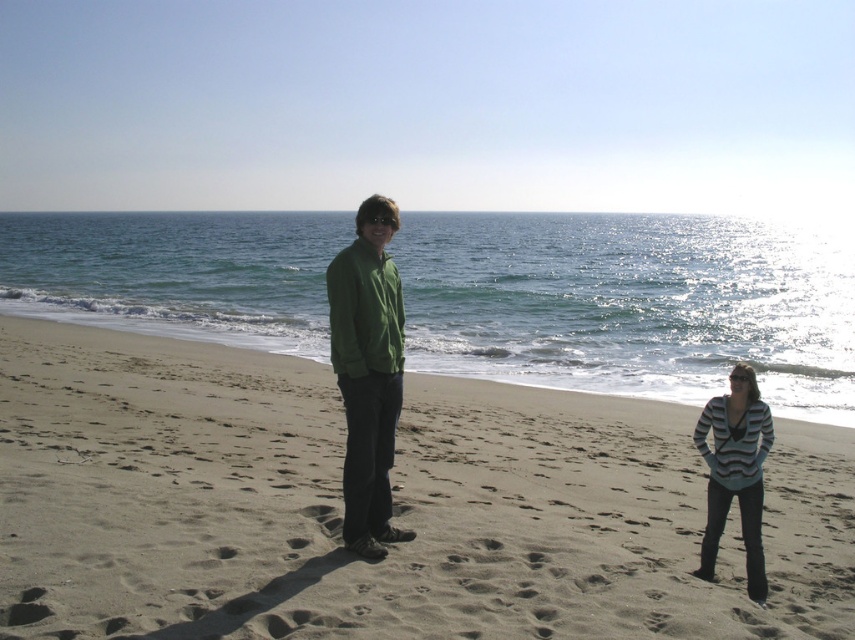
Question: Among these points, which one is farthest from the camera?

Choices:
 (A) (388, 316)
 (B) (145, 394)
 (C) (756, 492)

Answer: (B)

Question: Among these points, which one is farthest from the camera?

Choices:
 (A) [706, 416]
 (B) [162, 486]
 (C) [338, 284]

Answer: (B)

Question: Does green matte jacket at center have a smaller size compared to striped sweater at lower right?

Choices:
 (A) yes
 (B) no

Answer: (A)

Question: Can you confirm if brown sandy beach at center is positioned above striped sweater at lower right?

Choices:
 (A) no
 (B) yes

Answer: (A)

Question: Which is farther from the brown sandy beach at center?

Choices:
 (A) striped sweater at lower right
 (B) green matte jacket at center

Answer: (A)

Question: Is brown sandy beach at center thinner than striped sweater at lower right?

Choices:
 (A) yes
 (B) no

Answer: (B)